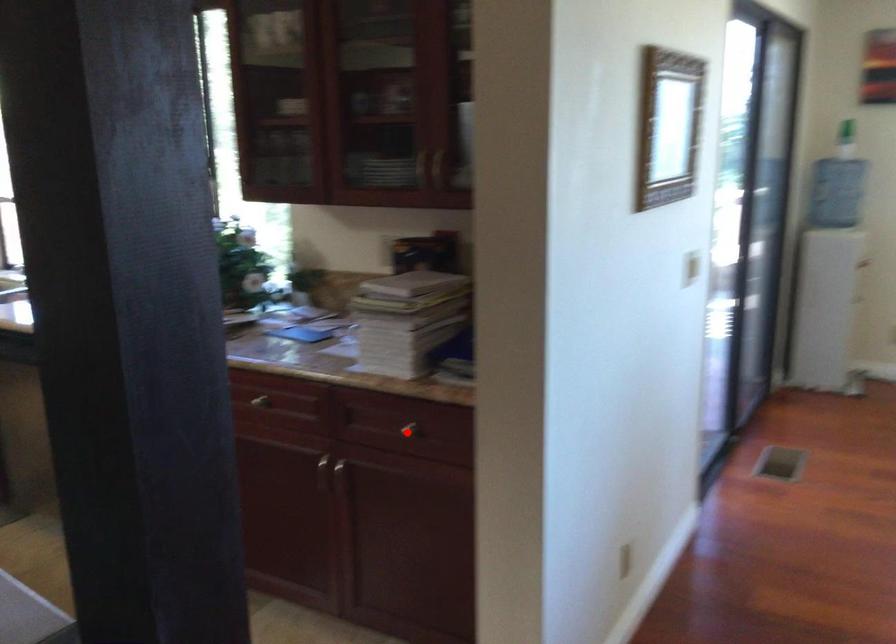
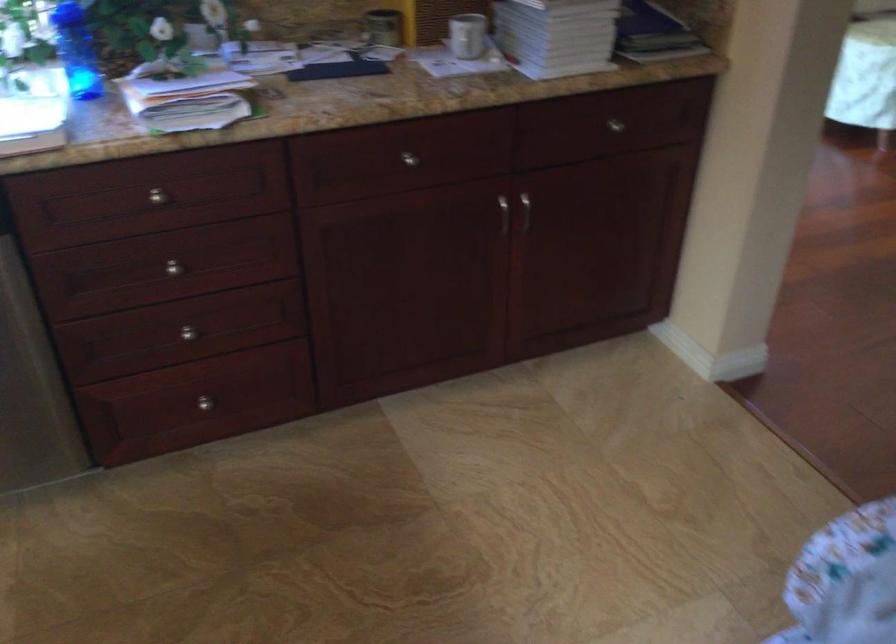
Question: I am providing you with two images of the same scene from different viewpoints. Image1 has a red point marked. In image2, the corresponding 3D location appears at what relative position? Reply with the corresponding letter.

Choices:
 (A) Closer
 (B) Farther

Answer: (A)